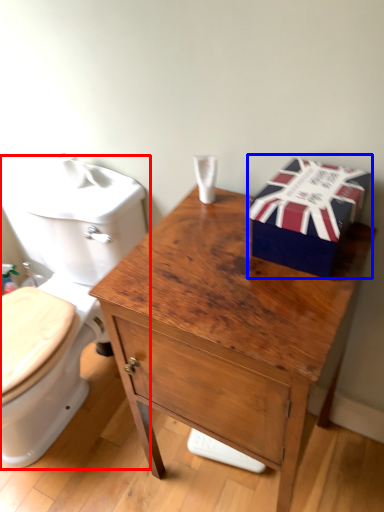
Question: Which object appears farthest to the camera in this image, toilet (highlighted by a red box) or gift box (highlighted by a blue box)?

Choices:
 (A) toilet
 (B) gift box

Answer: (A)